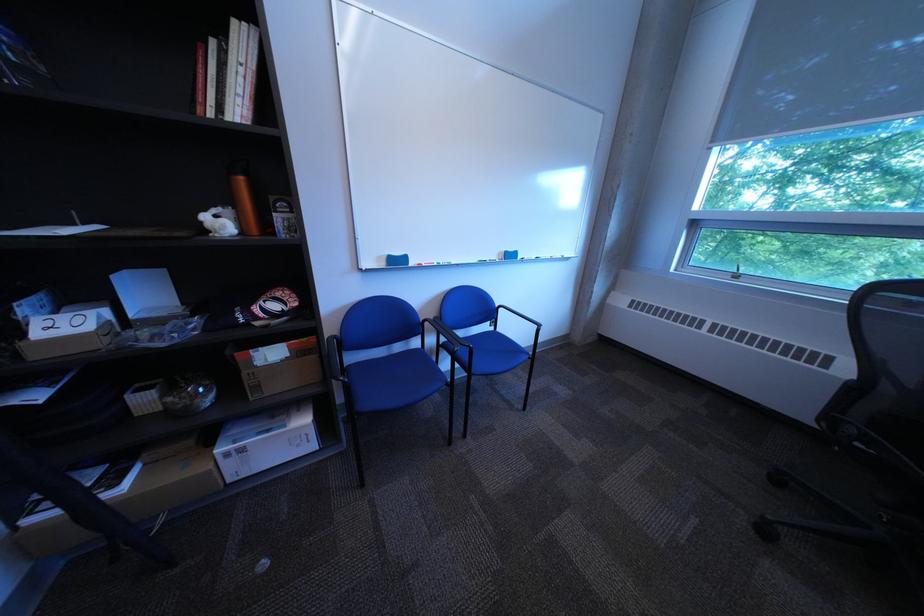
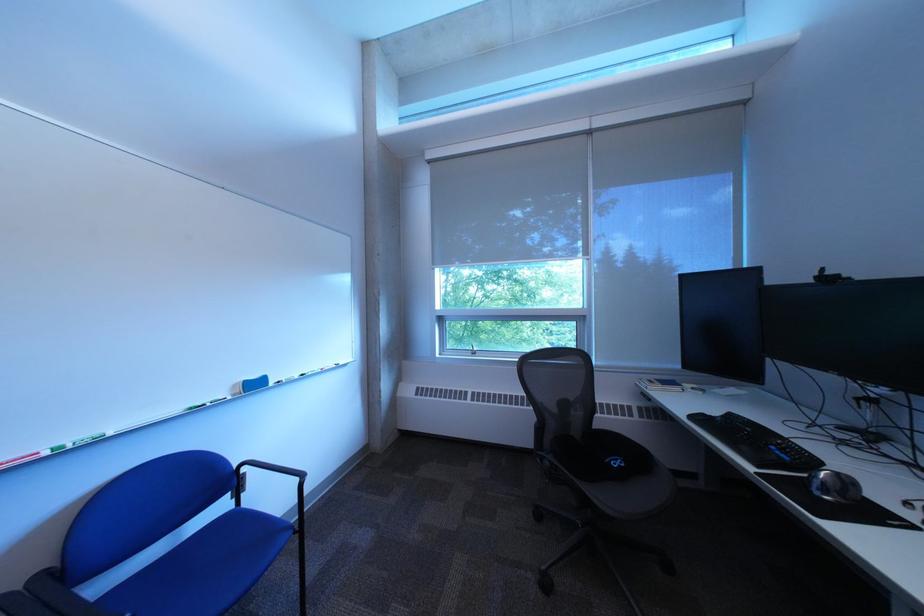
The point at [507,331] is marked in the first image. Where is the corresponding point in the second image?

(248, 508)